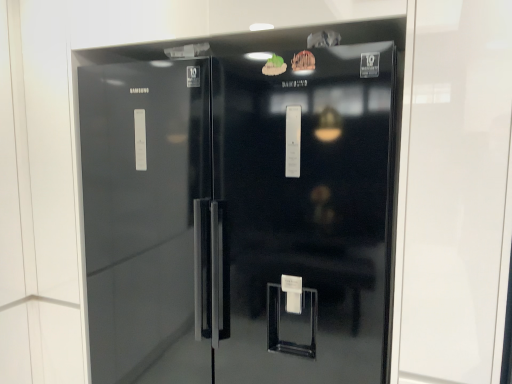
Question: Relative to glossy black refrigerator at center, is wooden carving at upper center, positioned as the 2th food in left-to-right order, in front or behind?

Choices:
 (A) behind
 (B) front

Answer: (A)

Question: In terms of size, does wooden carving at upper center, acting as the first food starting from the right, appear bigger or smaller than glossy black refrigerator at center?

Choices:
 (A) big
 (B) small

Answer: (B)

Question: Which object is the closest to the wooden carving at upper center, positioned as the 2th food in left-to-right order?

Choices:
 (A) glossy black refrigerator at center
 (B) green matte food at upper center, which appears as the first food when viewed from the left

Answer: (B)

Question: Which object is the farthest from the wooden carving at upper center, positioned as the 2th food in left-to-right order?

Choices:
 (A) glossy black refrigerator at center
 (B) green matte food at upper center, the second food from the right

Answer: (A)